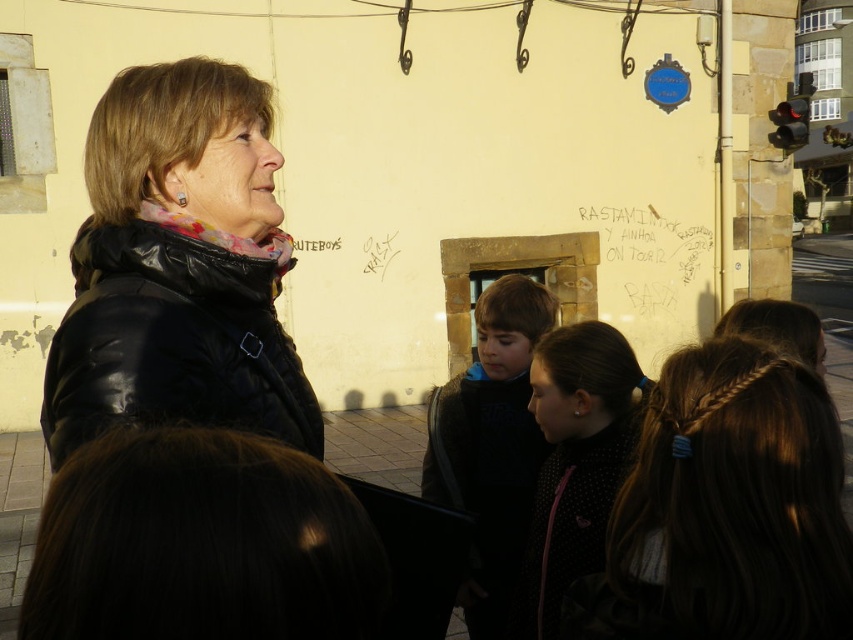
Question: Does brown hair at center appear under black graffiti at center?

Choices:
 (A) yes
 (B) no

Answer: (A)

Question: Based on their relative distances, which object is nearer to the dark blue sweater at center?

Choices:
 (A) black dotted jacket at center
 (B) dark brown hair at lower left
 (C) brown hair at center
 (D) black leather jacket at upper left

Answer: (A)

Question: Is black dotted jacket at center thinner than black graffiti at center?

Choices:
 (A) yes
 (B) no

Answer: (A)

Question: Observing the image, what is the correct spatial positioning of brown hair at center in reference to black graffiti at center?

Choices:
 (A) above
 (B) below

Answer: (B)

Question: Which object appears farthest from the camera in this image?

Choices:
 (A) brown hair at center
 (B) dark blue sweater at center
 (C) dark brown hair at lower left

Answer: (B)

Question: Among these points, which one is farthest from the camera?

Choices:
 (A) (212, 360)
 (B) (173, 602)
 (C) (595, 483)

Answer: (C)